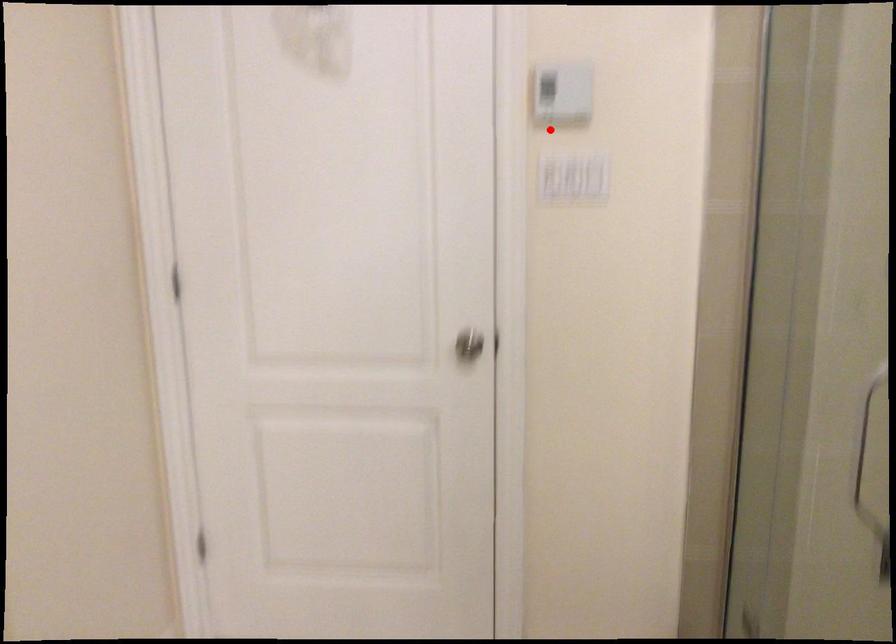
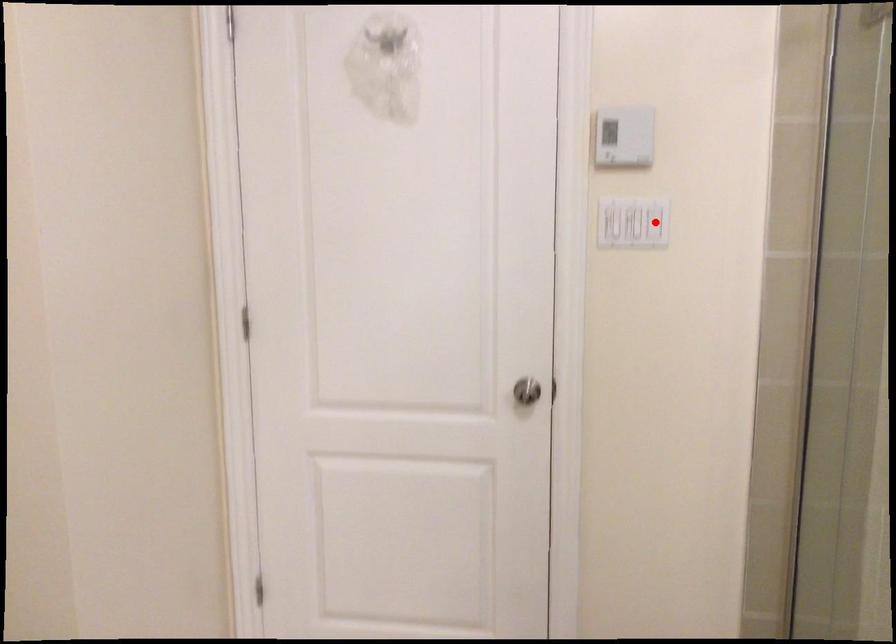
I am providing you with two images of the same scene from different viewpoints. A red point is marked on the first image and another point is marked on the second image. Is the red point in image1 aligned with the point shown in image2?

No